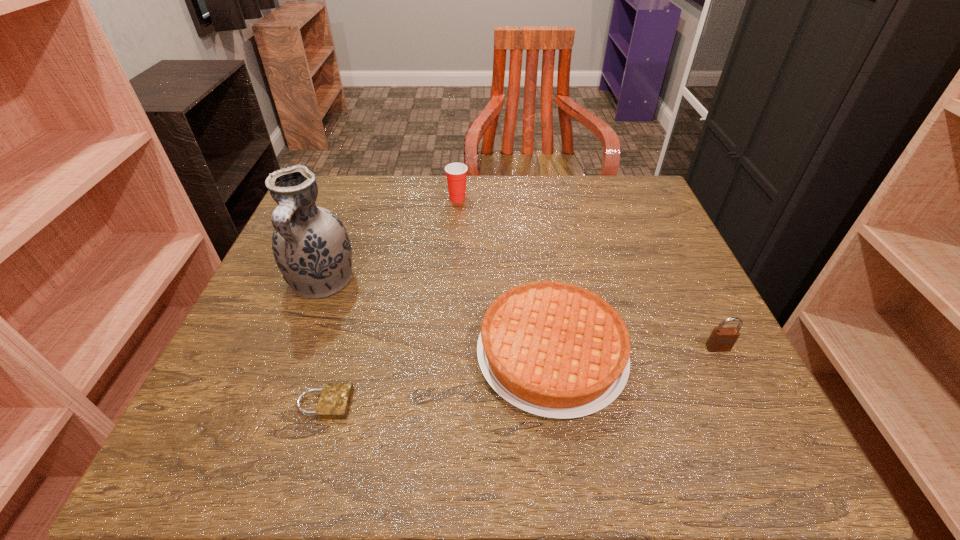
Where is `vase`? This screenshot has width=960, height=540. vase is located at coordinates (311, 247).

Identify the location of the farthest object. (456, 173).

I want to click on Dixie cup, so click(456, 173).

I want to click on the right padlock, so click(722, 339).

The width and height of the screenshot is (960, 540). What are the coordinates of `the rightmost object` in the screenshot? It's located at (722, 339).

Locate an element on the screen. The height and width of the screenshot is (540, 960). the fourth tallest object is located at coordinates click(556, 350).

Where is `pie`? This screenshot has width=960, height=540. pie is located at coordinates (556, 350).

Image resolution: width=960 pixels, height=540 pixels. I want to click on the nearer padlock, so click(x=334, y=401).

At what (x,y) coordinates should I click in order to perform the action: click on the left padlock. Please return your answer as a coordinate pair (x, y). Looking at the image, I should click on (334, 401).

Image resolution: width=960 pixels, height=540 pixels. Find the location of `free space located 0.050m with the handle on the side of the tallest object`. free space located 0.050m with the handle on the side of the tallest object is located at coordinates (304, 330).